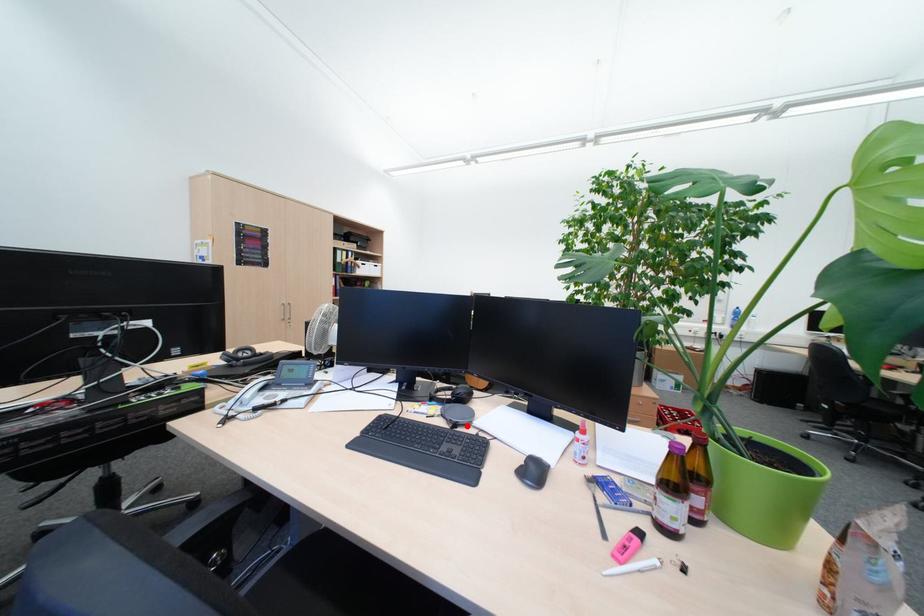
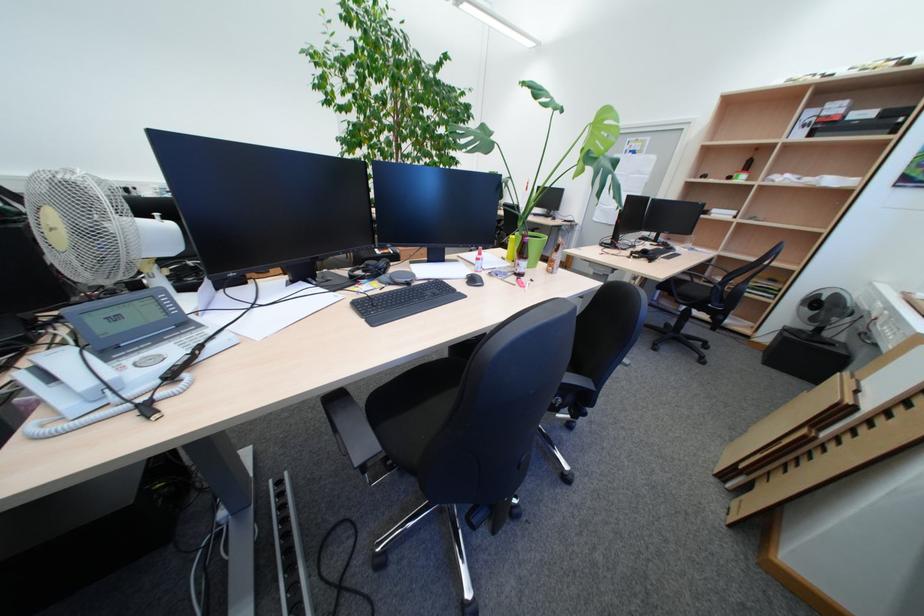
Find the pixel in the second image that matches the highlighted location in the first image.

(419, 285)